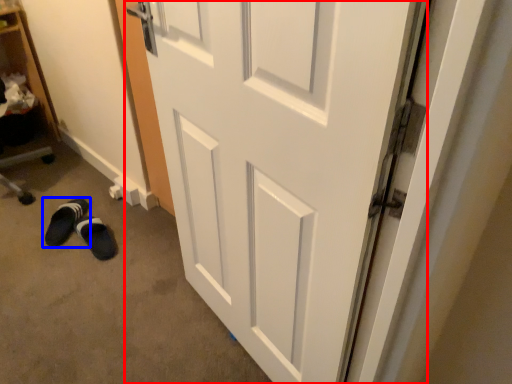
Question: Which point is further to the camera, door (highlighted by a red box) or footwear (highlighted by a blue box)?

Choices:
 (A) door
 (B) footwear

Answer: (B)